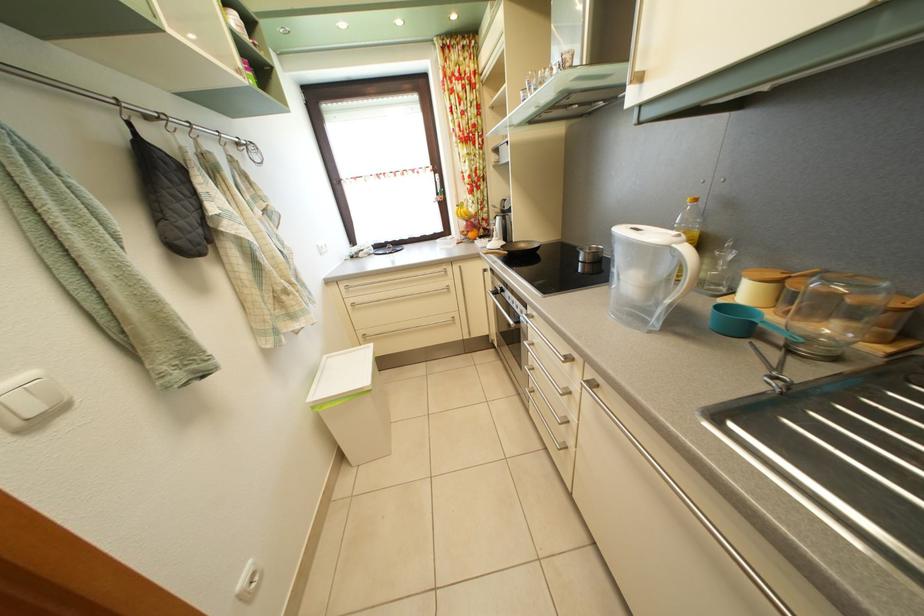
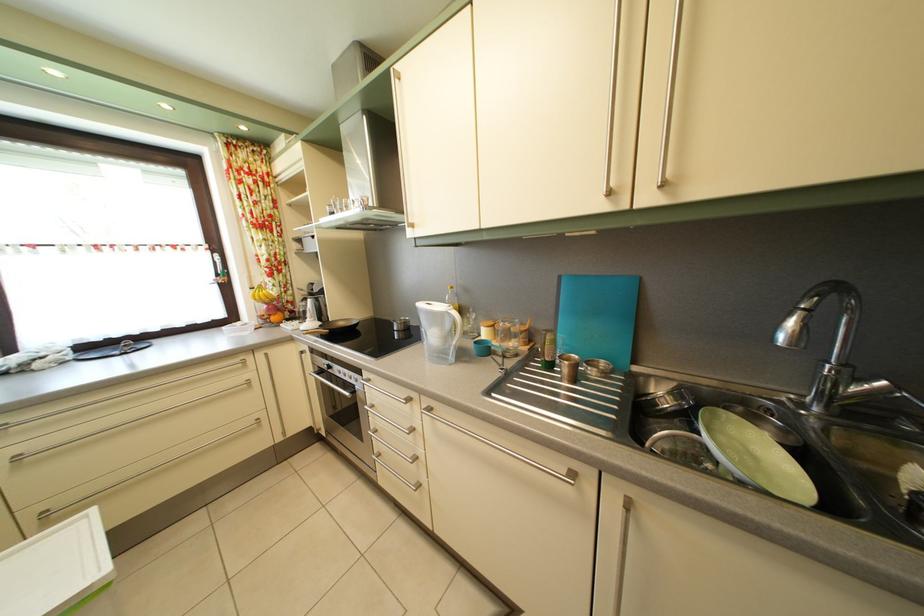
Find the pixel in the second image that matches (726,315) in the first image.

(483, 350)